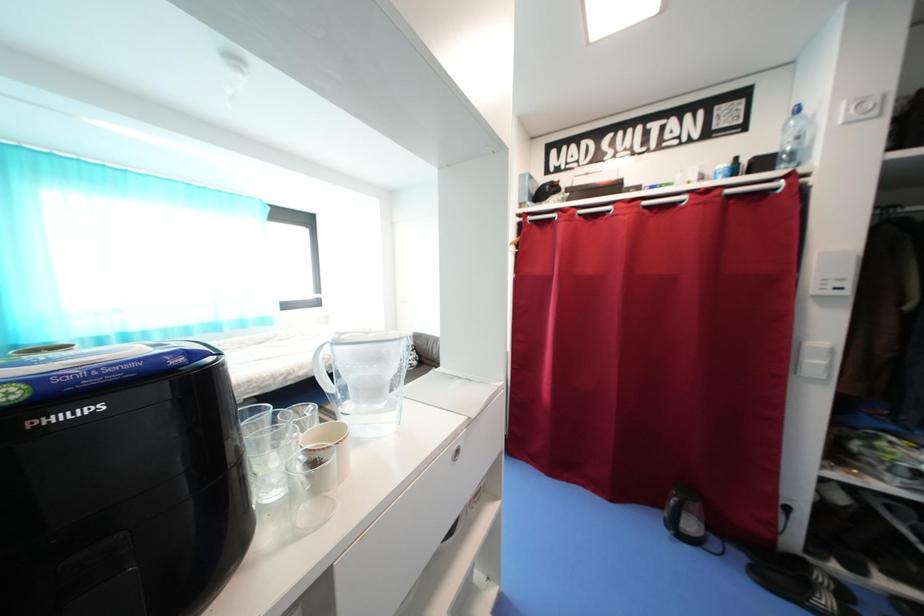
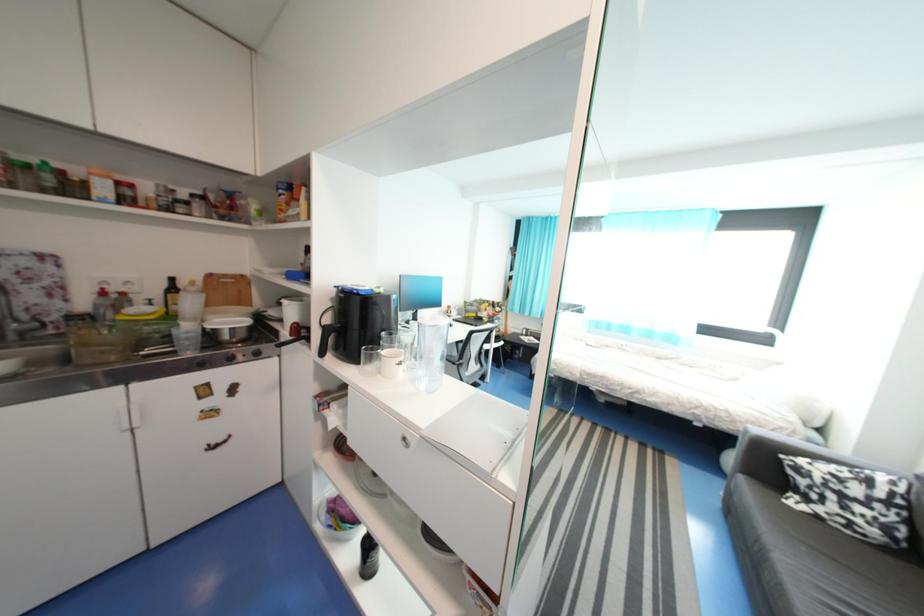
Question: The camera is either moving clockwise (left) or counter-clockwise (right) around the object. The first image is from the beginning of the video and the second image is from the end. Is the camera moving left or right when shooting the video?

Choices:
 (A) Left
 (B) Right

Answer: (B)